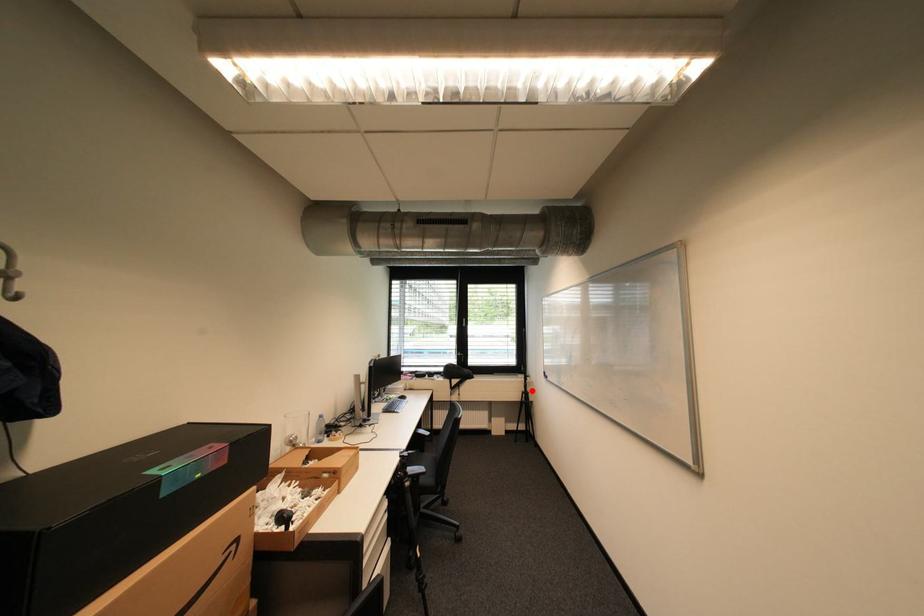
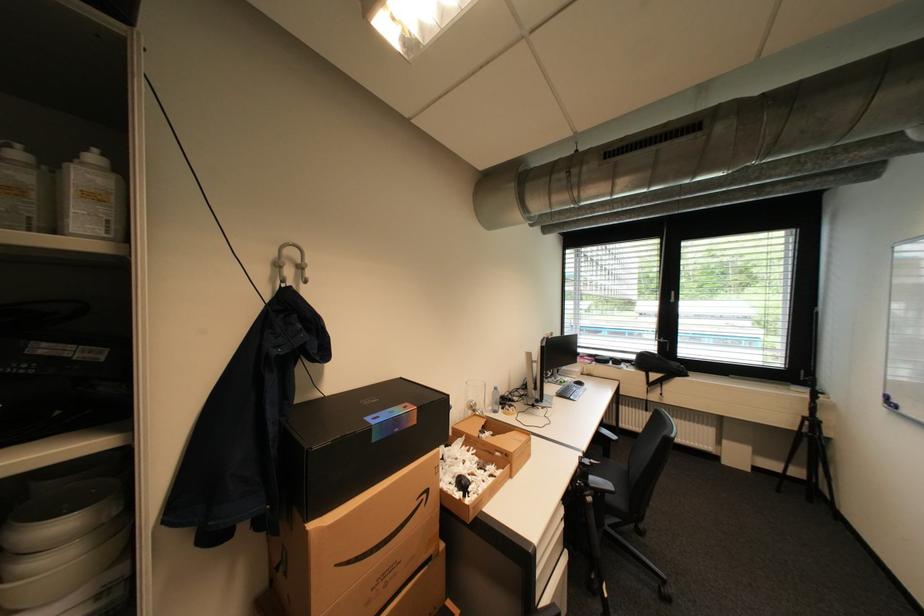
Question: I am providing you with two images of the same scene from different viewpoints. Given a red point in image1, look at the same physical point in image2. Is it:

Choices:
 (A) Closer to the viewpoint
 (B) Farther from the viewpoint

Answer: (A)